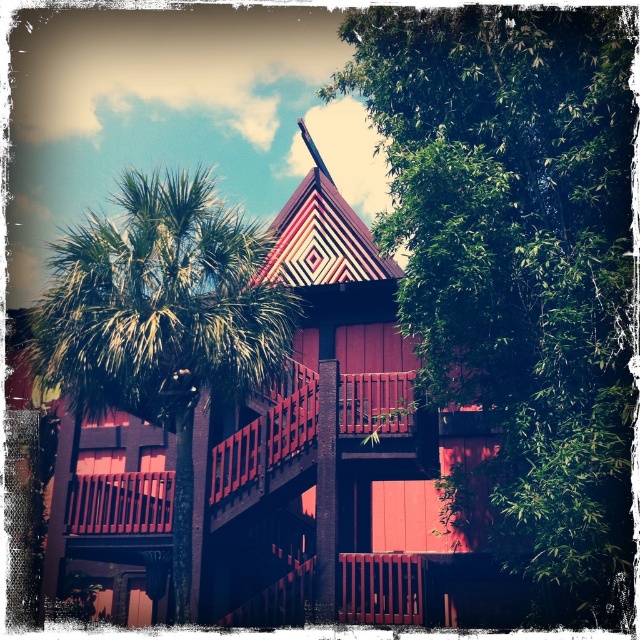
Question: Does green leafy tree at upper right appear on the right side of green leafy palm tree at left?

Choices:
 (A) no
 (B) yes

Answer: (B)

Question: Which point appears farthest from the camera in this image?

Choices:
 (A) (541, 387)
 (B) (104, 269)

Answer: (B)

Question: In this image, where is green leafy tree at upper right located relative to green leafy palm tree at left?

Choices:
 (A) above
 (B) below

Answer: (B)

Question: Is the position of green leafy tree at upper right less distant than that of green leafy palm tree at left?

Choices:
 (A) yes
 (B) no

Answer: (A)

Question: Which of the following is the farthest from the observer?

Choices:
 (A) (500, 458)
 (B) (141, 346)

Answer: (A)